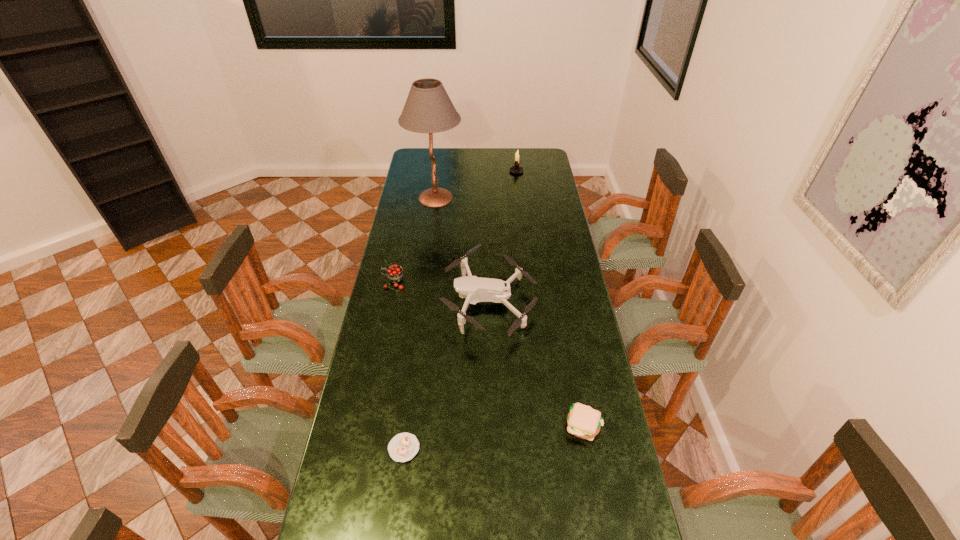
Locate an element on the screen. empty space between the tallest object and the cherry is located at coordinates (415, 240).

Find the location of a particular element. The width and height of the screenshot is (960, 540). vacant area that lies between the drone and the candle holder is located at coordinates (503, 237).

Locate an element on the screen. The width and height of the screenshot is (960, 540). free space between the cherry and the tallest object is located at coordinates (415, 240).

You are a GUI agent. You are given a task and a screenshot of the screen. Output one action in this format:
    pyautogui.click(x=<x>, y=<y>)
    Task: Click on the fifth closest object to the farthest object
    The image size is (960, 540).
    Given the screenshot: What is the action you would take?
    pyautogui.click(x=403, y=447)

Select which object appears as the fourth closest to the cherry. Please provide its 2D coordinates. Your answer should be formatted as a tuple, i.e. [(x, y)], where the tuple contains the x and y coordinates of a point satisfying the conditions above.

[(583, 421)]

I want to click on free space in the image that satisfies the following two spatial constraints: 1. with a camera at the front of the drone; 2. on the right side of the second shortest object, so click(492, 425).

In order to click on vacant point that satisfies the following two spatial constraints: 1. with a camera at the front of the drone; 2. on the front side of the cupcake in this screenshot , I will do `click(492, 448)`.

In order to click on free location that satisfies the following two spatial constraints: 1. with a camera at the front of the drone; 2. on the front side of the cupcake in this screenshot , I will do `click(492, 448)`.